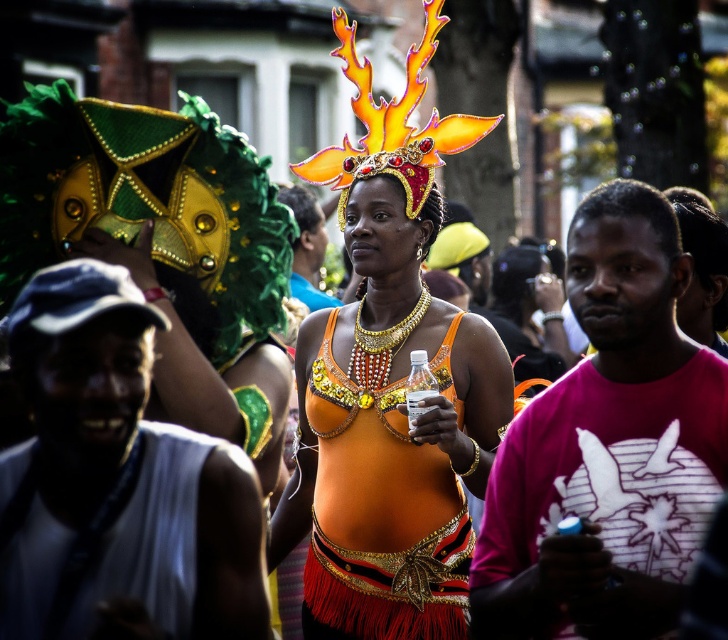
You are a photographer standing at the edge of the street. You want to take a photo that includes both the orange fabric dress at center and the white fabric shirt at center. The camera you are using has a maximum focus range of 10 meters. Can you capture both subjects in focus without moving your position?

The orange fabric dress at center is 15.22 meters away from the white fabric shirt at center. Since the camera can only focus up to 10 meters, the distance between them exceeds the maximum focus range. Therefore, you cannot capture both subjects in focus without moving your position.

You are a photographer at the event and want to capture both the pink fabric shirt at right and the white fabric shirt at center in the same frame. Which shirt should you focus on to ensure both are in the frame without moving the camera?

Since the pink fabric shirt at right is larger in size compared to the white fabric shirt at center, you should focus on the pink fabric shirt at right to ensure both are in the frame without moving the camera.

In the festive street scene, you notice two orange items worn by the central woman. One is the orange fabric dress at center and the other is the orange sequined top at center. Which one is positioned higher on her body?

The orange fabric dress at center is above the orange sequined top at center, so the orange fabric dress at center is positioned higher on her body.